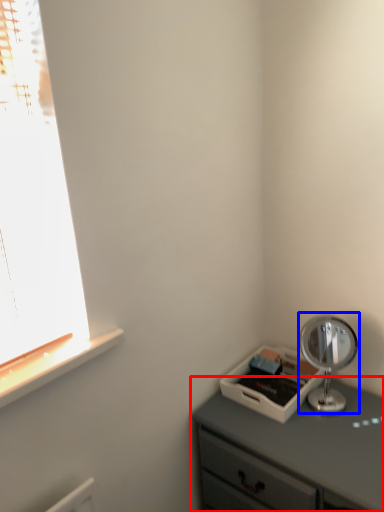
Question: Which point is closer to the camera, chest of drawers (highlighted by a red box) or table lamp (highlighted by a blue box)?

Choices:
 (A) chest of drawers
 (B) table lamp

Answer: (A)